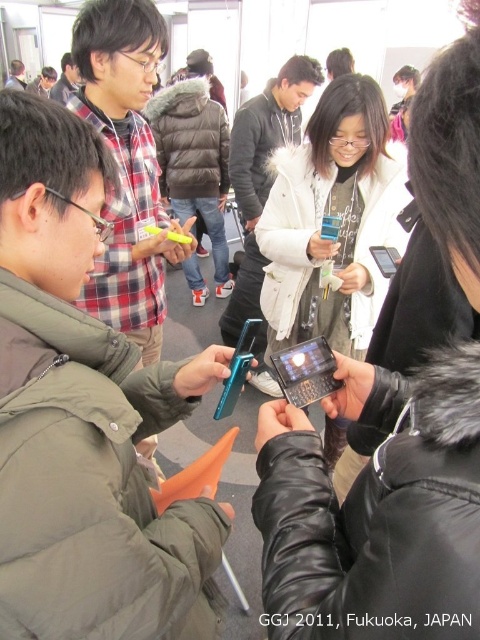
Question: Which object appears farthest from the camera in this image?

Choices:
 (A) matte green jacket at left
 (B) matte black jacket at upper center
 (C) matte plaid shirt at upper left

Answer: (B)

Question: Is matte green jacket at left positioned behind sleek black phone at center?

Choices:
 (A) no
 (B) yes

Answer: (A)

Question: Estimate the real-world distances between objects in this image. Which object is farther from the matte black jacket at upper left?

Choices:
 (A) matte plaid shirt at upper left
 (B) sleek black phone at center

Answer: (B)

Question: Which point is closer to the camera?

Choices:
 (A) (14, 64)
 (B) (253, 227)

Answer: (B)

Question: Is matte green jacket at left above black glossy smartphone at center?

Choices:
 (A) no
 (B) yes

Answer: (B)

Question: Is sleek black phone at center closer to camera compared to matte black jacket at upper center?

Choices:
 (A) yes
 (B) no

Answer: (A)